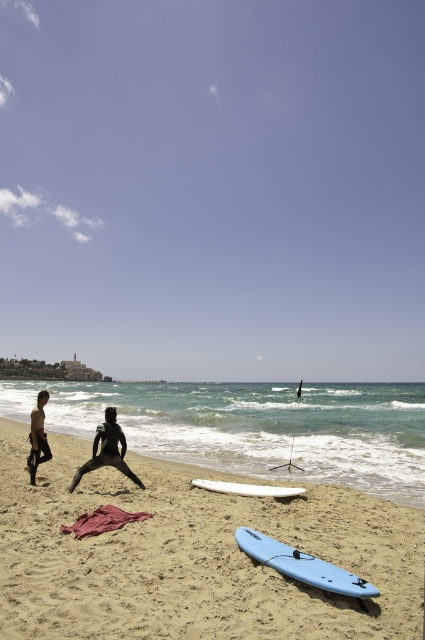
You are a beachgoer who wants to place your new surfboard on the sand. The surfboard is 1.8 meters long. Can you safely place it on the smooth sand at center without overlapping the white matte surfboard at center?

The distance between smooth sand at center and white matte surfboard at center is 1.74 meters. Since the surfboard is 1.8 meters long, placing it there would cause an overlap of 0.06 meters with the white matte surfboard at center.

You are a photographer trying to capture the white matte surfboard at center and the smooth sand at center in the same frame. Based on their positions, which object is closer to the left side of the frame?

The smooth sand at center is to the left of the white matte surfboard at center, so it is closer to the left side of the frame.